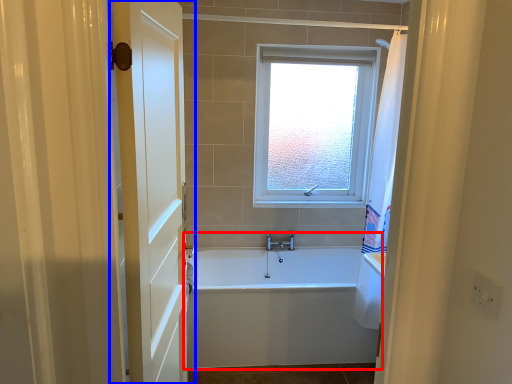
Question: Which object is closer to the camera taking this photo, bathtub (highlighted by a red box) or door (highlighted by a blue box)?

Choices:
 (A) bathtub
 (B) door

Answer: (B)